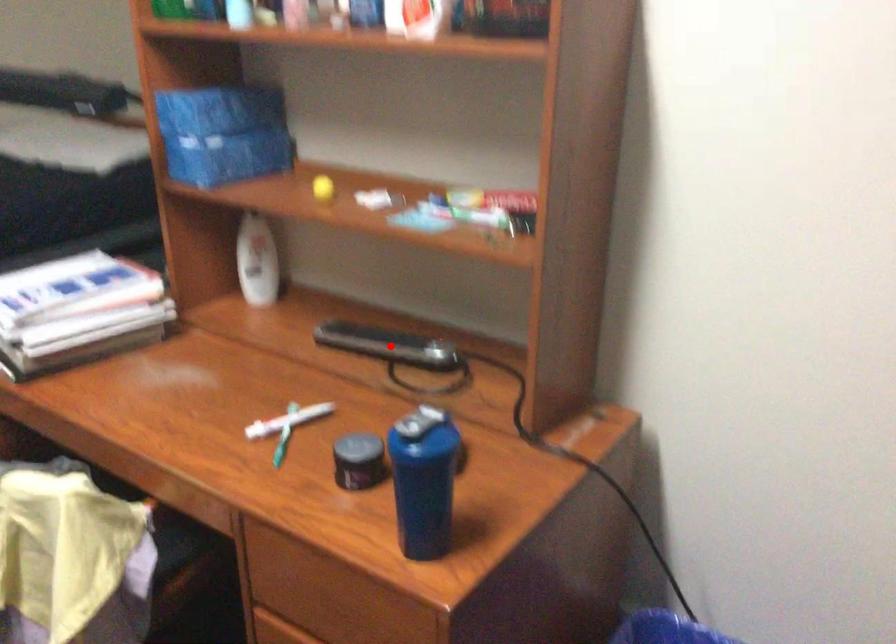
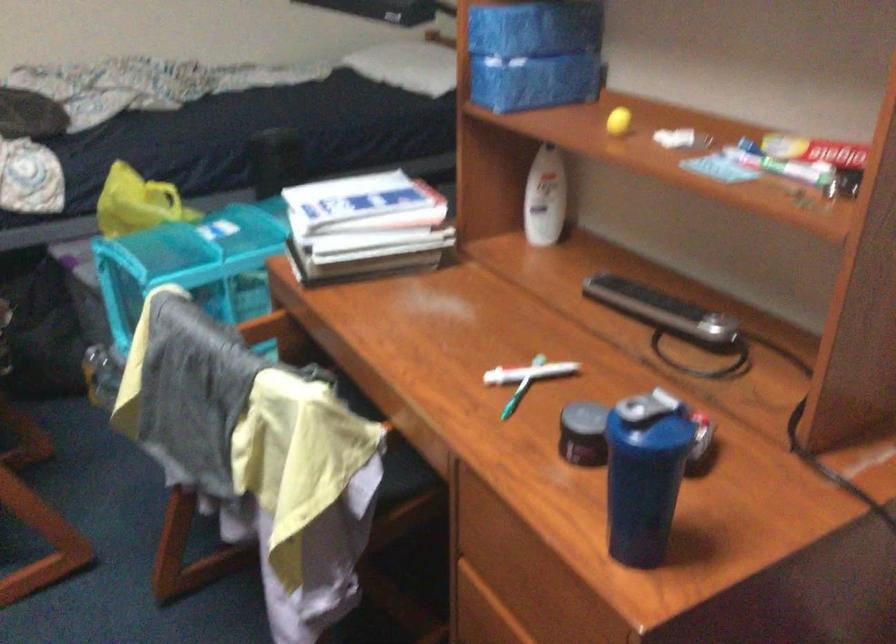
Question: I am providing you with two images of the same scene from different viewpoints. In image1, a red point is highlighted. Considering the same 3D point in image2, which of the following is correct?

Choices:
 (A) It is closer
 (B) It is farther

Answer: (A)